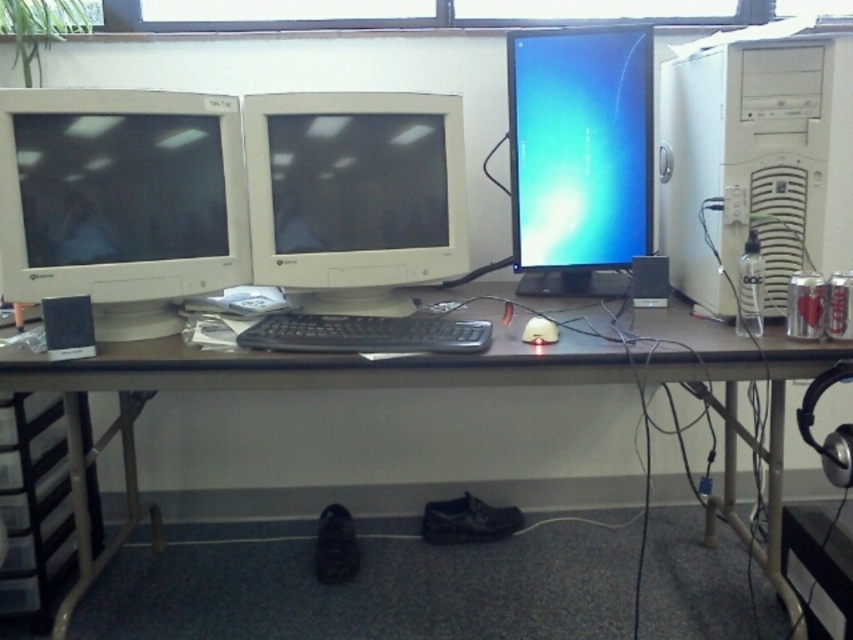
Is the position of white plastic tower at right more distant than that of white matte mouse at center?

No, it is in front of white matte mouse at center.

Between point (808, 177) and point (534, 316), which one is positioned in front?

Point (808, 177) is more forward.

At what (x,y) coordinates should I click in order to perform the action: click on white plastic tower at right. Please return your answer as a coordinate pair (x, y). This screenshot has width=853, height=640. Looking at the image, I should click on (755, 161).

Does brown wooden table at center appear over matte black monitor at center?

Actually, brown wooden table at center is below matte black monitor at center.

Does brown wooden table at center come in front of matte black monitor at center?

Yes, it is in front of matte black monitor at center.

Locate an element on the screen. brown wooden table at center is located at coordinates (431, 387).

Is brown wooden table at center further to the viewer compared to matte white monitor at center?

No, brown wooden table at center is closer to the viewer.

Which is below, brown wooden table at center or matte white monitor at center?

Positioned lower is brown wooden table at center.

You are a GUI agent. You are given a task and a screenshot of the screen. Output one action in this format:
    pyautogui.click(x=<x>, y=<y>)
    Task: Click on the brown wooden table at center
    
    Given the screenshot: What is the action you would take?
    pyautogui.click(x=431, y=387)